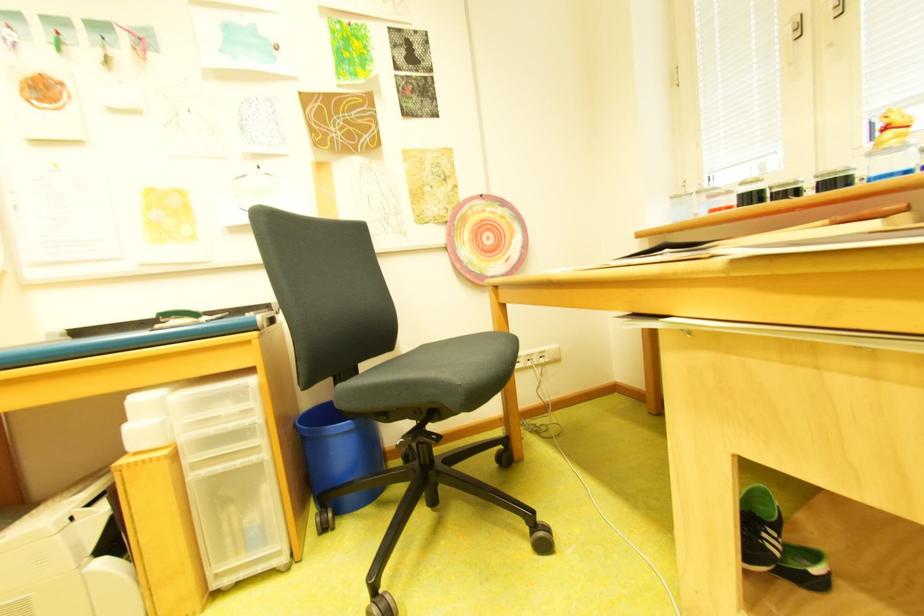
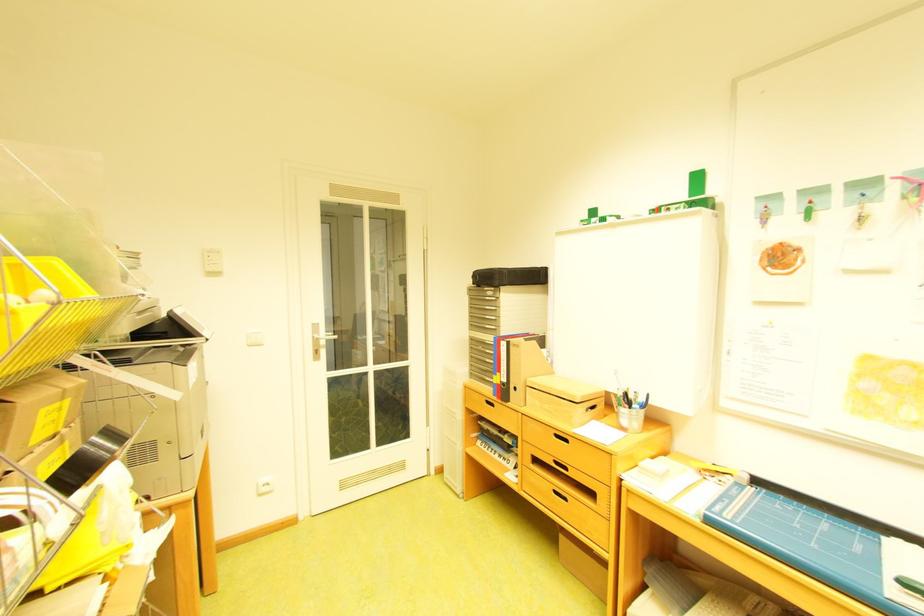
Question: The camera is either moving clockwise (left) or counter-clockwise (right) around the object. The first image is from the beginning of the video and the second image is from the end. Is the camera moving left or right when shooting the video?

Choices:
 (A) Left
 (B) Right

Answer: (B)